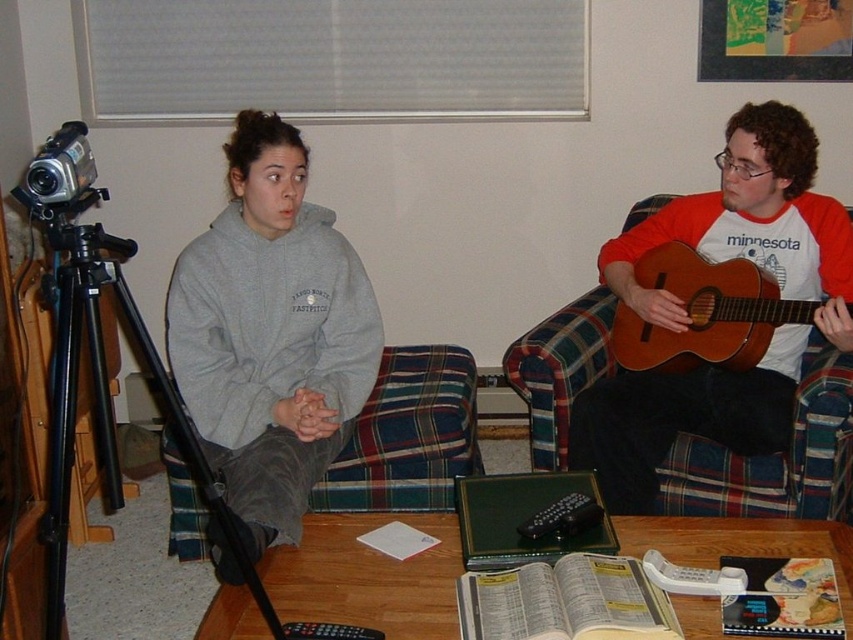
Question: Can you confirm if plaid fabric couch at right is wider than black plastic remote at center?

Choices:
 (A) no
 (B) yes

Answer: (B)

Question: Does black metal tripod at left appear over silver plastic video camera at left?

Choices:
 (A) yes
 (B) no

Answer: (B)

Question: Does plaid fabric couch at right have a lesser width compared to black metal tripod at left?

Choices:
 (A) no
 (B) yes

Answer: (A)

Question: Among these points, which one is nearest to the camera?

Choices:
 (A) (297, 413)
 (B) (53, 140)

Answer: (B)

Question: Which object is positioned farthest from the gray fleece sweatshirt at center?

Choices:
 (A) black metal tripod at left
 (B) black plastic remote at lower center
 (C) silver plastic video camera at left
 (D) brown wooden guitar at right

Answer: (D)

Question: Which is farther from the brown wooden guitar at right?

Choices:
 (A) black metal tripod at left
 (B) black plastic remote at lower center

Answer: (A)